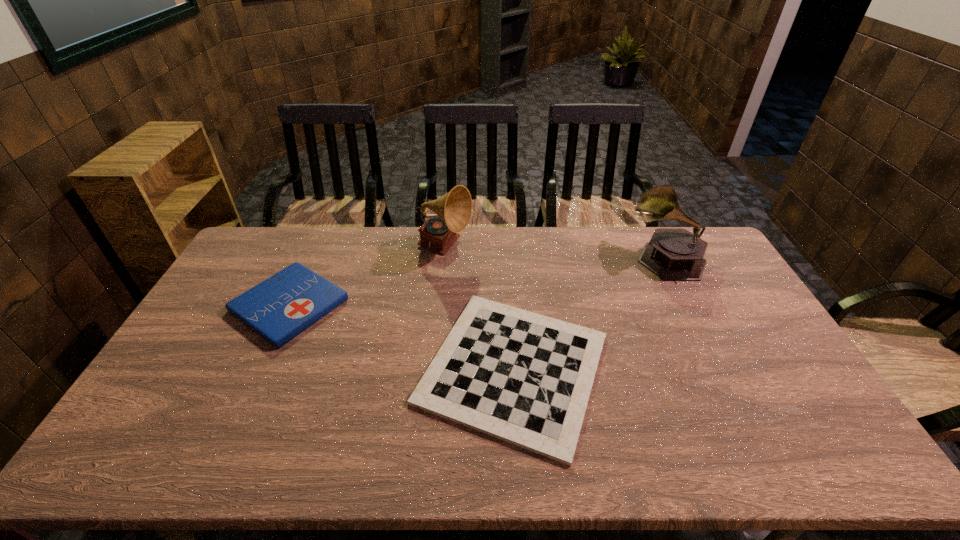
Image resolution: width=960 pixels, height=540 pixels. I want to click on vacant area that satisfies the following two spatial constraints: 1. on the horn of the left phonograph record; 2. on the back side of the shortest object, so click(433, 368).

I want to click on free spot that satisfies the following two spatial constraints: 1. on the horn of the left phonograph record; 2. on the right side of the shortest object, so click(433, 368).

Locate an element on the screen. The height and width of the screenshot is (540, 960). free space that satisfies the following two spatial constraints: 1. on the front side of the shortest object; 2. on the right side of the third tallest object is located at coordinates (260, 368).

Locate an element on the screen. free space that satisfies the following two spatial constraints: 1. on the horn of the left phonograph record; 2. on the back side of the shortest object is located at coordinates (433, 368).

Find the location of a particular element. free region that satisfies the following two spatial constraints: 1. on the horn direction of the rightmost object; 2. on the front side of the checkerboard is located at coordinates (722, 368).